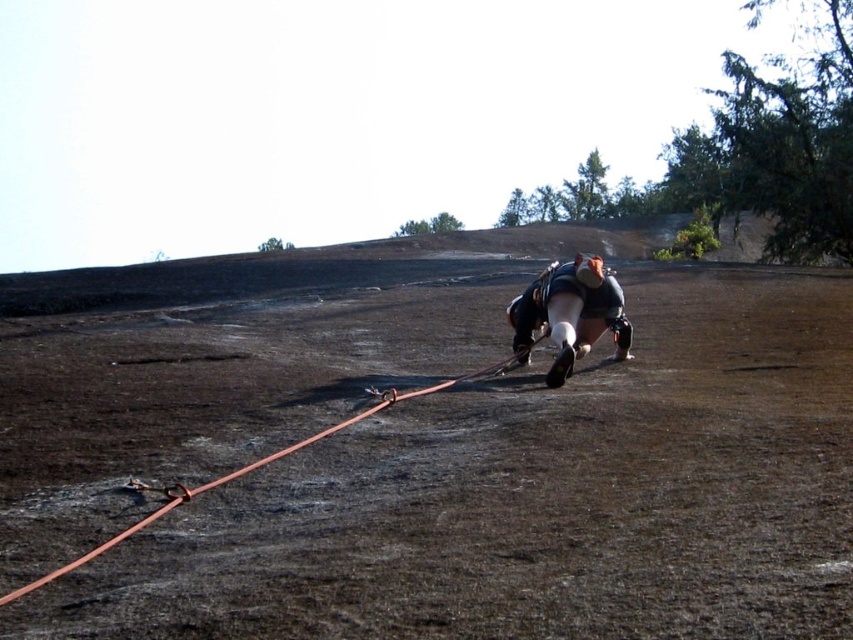
Question: Which of these objects is positioned closest to the matte black helmet at center?

Choices:
 (A) orange rubber rope at lower left
 (B) brown matte dirt field at center

Answer: (A)

Question: Does matte black helmet at center have a lesser width compared to orange rubber rope at lower left?

Choices:
 (A) no
 (B) yes

Answer: (B)

Question: Estimate the real-world distances between objects in this image. Which object is farther from the brown matte dirt field at center?

Choices:
 (A) matte black helmet at center
 (B) orange rubber rope at lower left

Answer: (A)

Question: Which object appears farthest from the camera in this image?

Choices:
 (A) brown matte dirt field at center
 (B) matte black helmet at center
 (C) orange rubber rope at lower left

Answer: (B)

Question: Is matte black helmet at center below orange rubber rope at lower left?

Choices:
 (A) yes
 (B) no

Answer: (B)

Question: Is brown matte dirt field at center below matte black helmet at center?

Choices:
 (A) no
 (B) yes

Answer: (B)